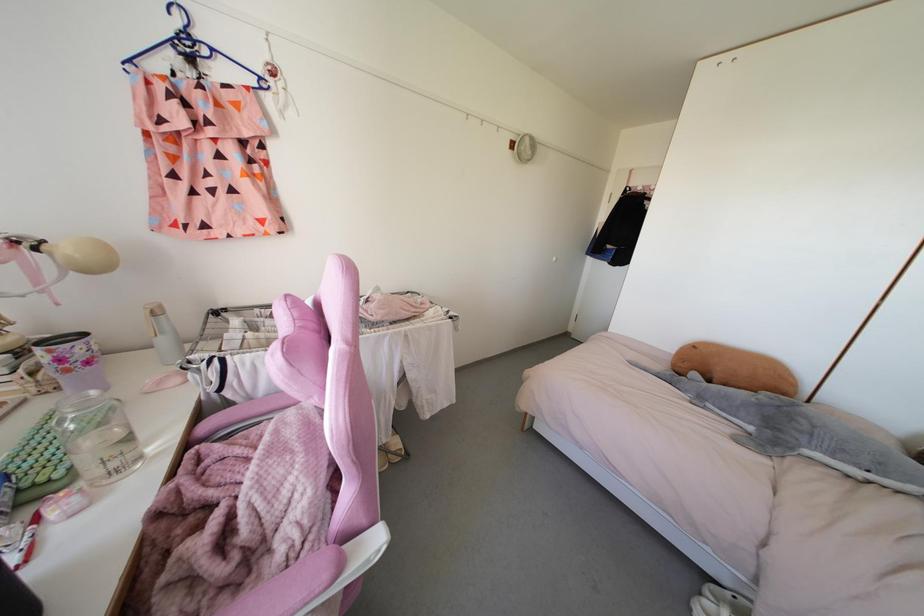
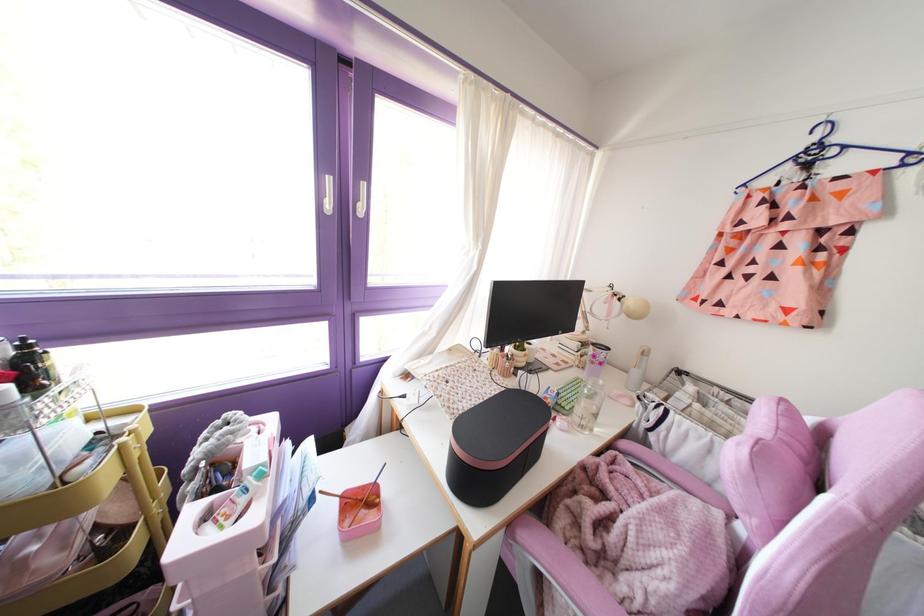
The point at (92, 392) is marked in the first image. Where is the corresponding point in the second image?

(601, 382)